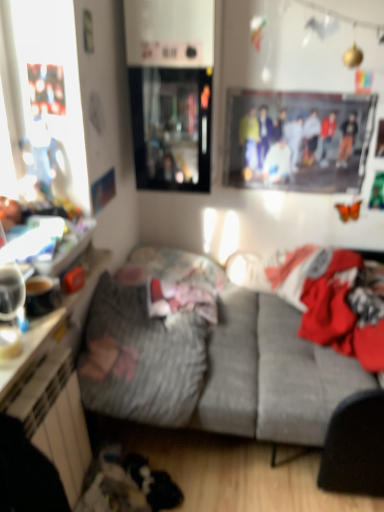
Question: Considering the relative sizes of printed fabric poster at upper center and gray fabric couch at center in the image provided, is printed fabric poster at upper center bigger than gray fabric couch at center?

Choices:
 (A) yes
 (B) no

Answer: (B)

Question: Could gray fabric couch at center be considered to be inside printed fabric poster at upper center?

Choices:
 (A) no
 (B) yes

Answer: (A)

Question: Is printed fabric poster at upper center oriented towards gray fabric couch at center?

Choices:
 (A) yes
 (B) no

Answer: (B)

Question: From a real-world perspective, is printed fabric poster at upper center physically below gray fabric couch at center?

Choices:
 (A) no
 (B) yes

Answer: (A)

Question: Is printed fabric poster at upper center to the left of gray fabric couch at center from the viewer's perspective?

Choices:
 (A) no
 (B) yes

Answer: (A)

Question: Is printed fabric poster at upper center completely or partially outside of gray fabric couch at center?

Choices:
 (A) yes
 (B) no

Answer: (A)

Question: Would you say fluffy gray blanket at center is a long distance from printed fabric poster at upper center?

Choices:
 (A) yes
 (B) no

Answer: (A)

Question: Is fluffy gray blanket at center to the left of printed fabric poster at upper center from the viewer's perspective?

Choices:
 (A) no
 (B) yes

Answer: (B)

Question: Does fluffy gray blanket at center come in front of printed fabric poster at upper center?

Choices:
 (A) yes
 (B) no

Answer: (A)

Question: Is printed fabric poster at upper center inside fluffy gray blanket at center?

Choices:
 (A) no
 (B) yes

Answer: (A)

Question: Does fluffy gray blanket at center have a lesser height compared to printed fabric poster at upper center?

Choices:
 (A) no
 (B) yes

Answer: (B)

Question: Does fluffy gray blanket at center lie behind printed fabric poster at upper center?

Choices:
 (A) no
 (B) yes

Answer: (A)

Question: Considering the relative positions of gray fabric couch at center and transparent glass cabinet at upper center in the image provided, is gray fabric couch at center to the right of transparent glass cabinet at upper center from the viewer's perspective?

Choices:
 (A) yes
 (B) no

Answer: (A)